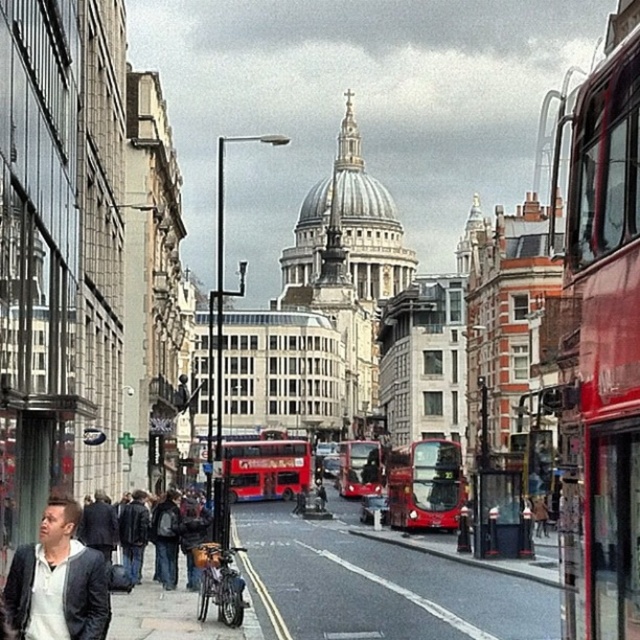
Question: Can you confirm if smooth asphalt road at center is positioned below red matte bus at center?

Choices:
 (A) yes
 (B) no

Answer: (A)

Question: Is red metallic bus at right above matte black jacket at lower left?

Choices:
 (A) yes
 (B) no

Answer: (A)

Question: Among these objects, which one is farthest from the camera?

Choices:
 (A) matte black jacket at lower left
 (B) dark blue suit at lower left

Answer: (B)

Question: Which point is farther to the camera?

Choices:
 (A) (49, 556)
 (B) (401, 468)

Answer: (B)

Question: Is matte black jacket at lower left bigger than red matte bus at center?

Choices:
 (A) no
 (B) yes

Answer: (A)

Question: Considering the real-world distances, which object is farthest from the dark blue suit at lower left?

Choices:
 (A) red matte double-decker bus at center
 (B) red metallic bus at right
 (C) red matte bus at center

Answer: (C)